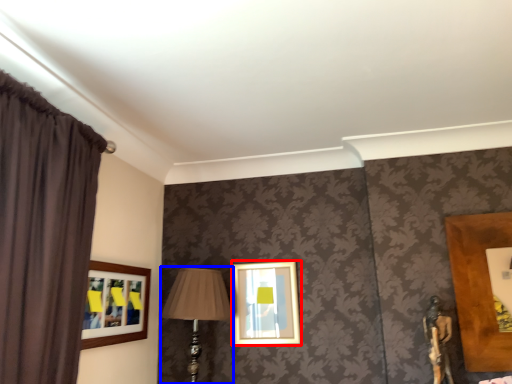
Question: Among these objects, which one is farthest to the camera, picture frame (highlighted by a red box) or table lamp (highlighted by a blue box)?

Choices:
 (A) picture frame
 (B) table lamp

Answer: (A)